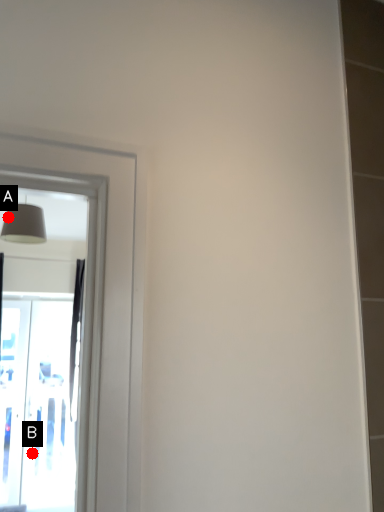
Question: Two points are circled on the image, labeled by A and B beside each circle. Among these points, which one is farthest from the camera?

Choices:
 (A) A is further
 (B) B is further

Answer: (B)